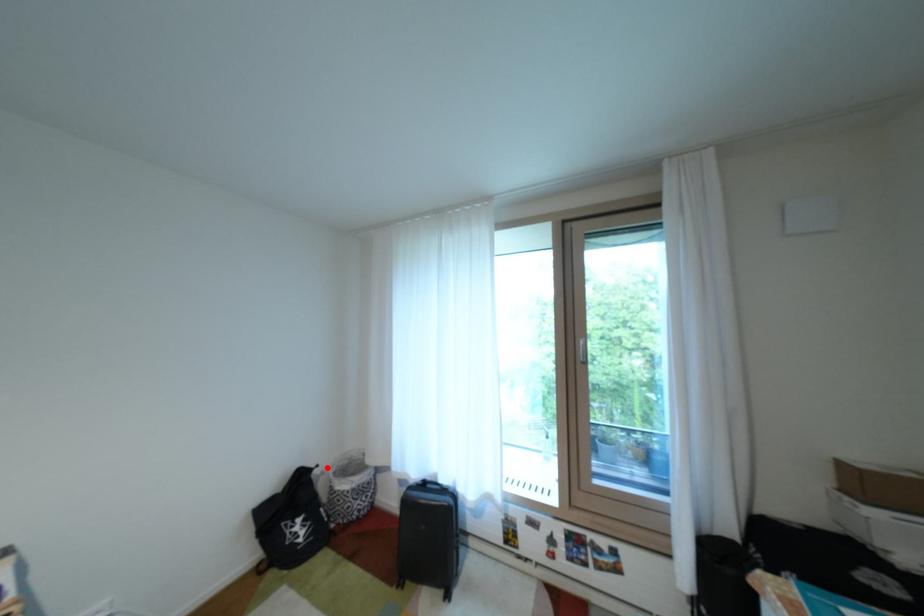
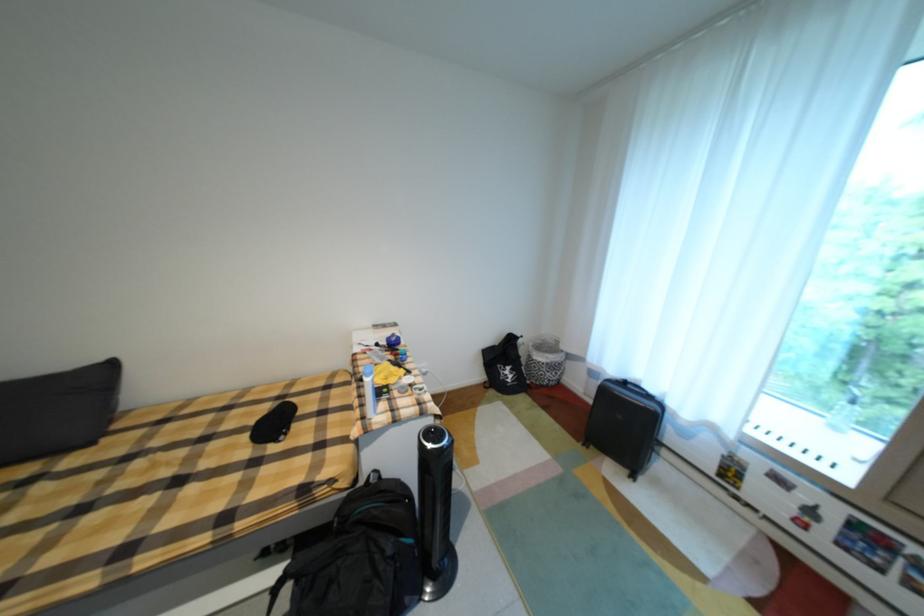
Question: I am providing you with two images of the same scene from different viewpoints. In image1, a red point is highlighted. Considering the same 3D point in image2, which of the following is correct?

Choices:
 (A) It is closer
 (B) It is farther

Answer: (B)